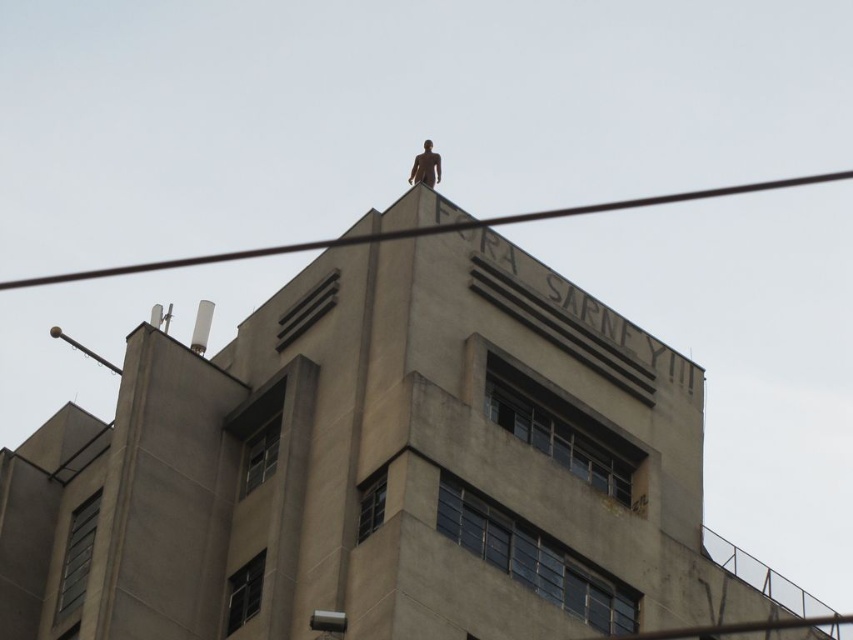
Question: Where is black wire at upper center located in relation to bronze statue at top in the image?

Choices:
 (A) below
 (B) above

Answer: (B)

Question: Which point is farther to the camera?

Choices:
 (A) (265, 248)
 (B) (416, 170)

Answer: (A)

Question: Is black wire at upper center below bronze statue at top?

Choices:
 (A) no
 (B) yes

Answer: (A)

Question: Is black wire at upper center above bronze statue at top?

Choices:
 (A) no
 (B) yes

Answer: (B)